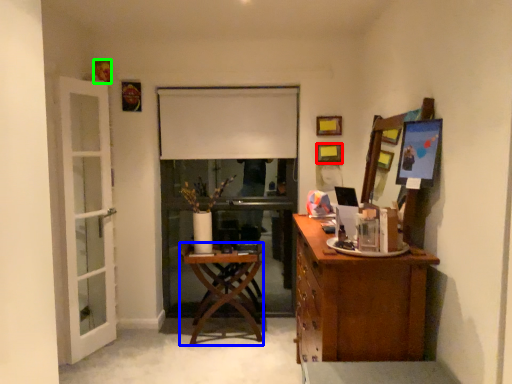
Question: Which object is the closest to the picture frame (highlighted by a red box)? Choose among these: desk (highlighted by a blue box) or picture frame (highlighted by a green box).

Choices:
 (A) desk
 (B) picture frame

Answer: (A)